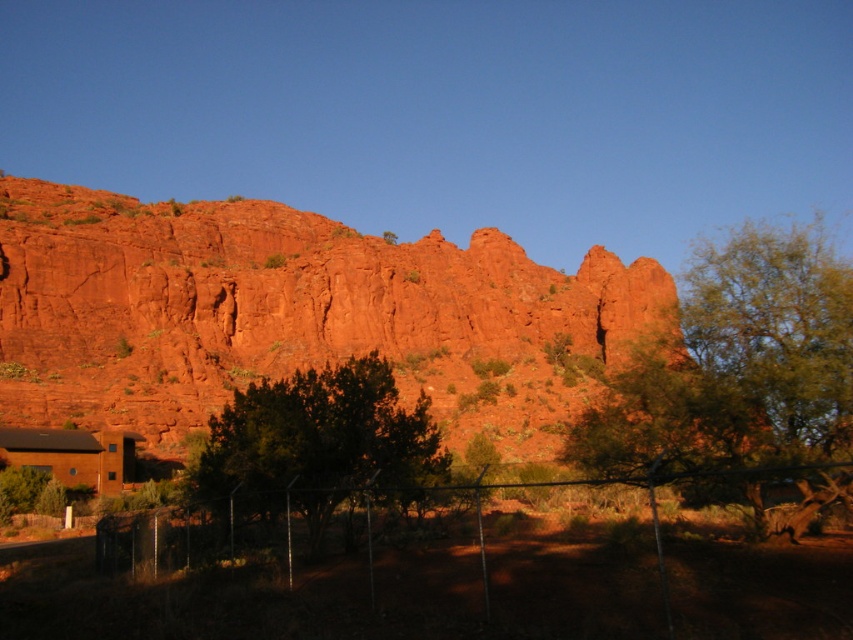
In the scene shown: You are a photographer planning to capture a landscape shot that includes both the rustic rock formation at center and the green leafy tree at center. Given their sizes, which object should you position closer to the center of your camera frame to ensure both are adequately framed without cropping?

The rustic rock formation at center is wider than the green leafy tree at center. To ensure both are adequately framed without cropping, you should position the rustic rock formation at center closer to the center of your camera frame since it is larger and requires more space.